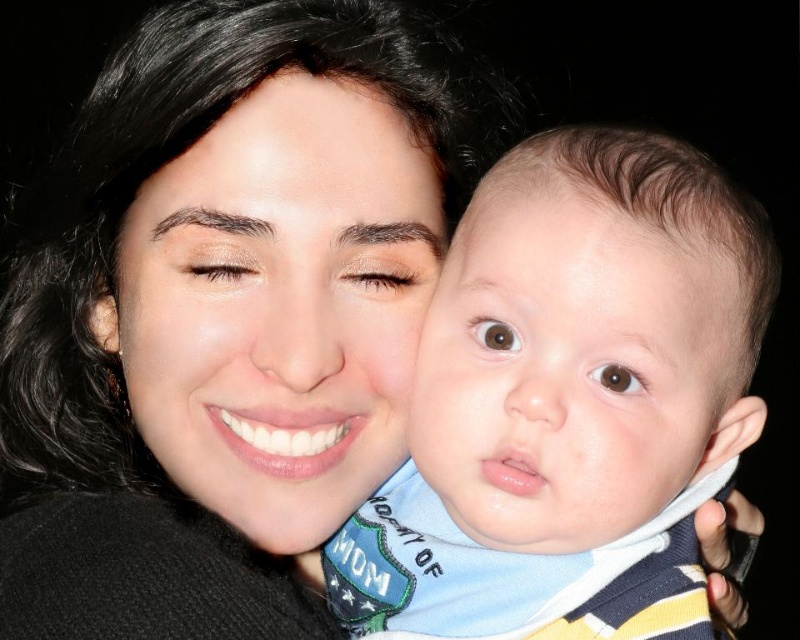
Based on the scene description, which object has a larger size between the smooth skin face at center and the smooth skin baby at center?

The smooth skin face at center is larger in size than the smooth skin baby at center according to the description.

Looking at the image of the woman and the baby, which object has a thinner appearance between the smooth skin baby at center and the smooth skin at upper center?

The smooth skin baby at center is thinner than the smooth skin at upper center.